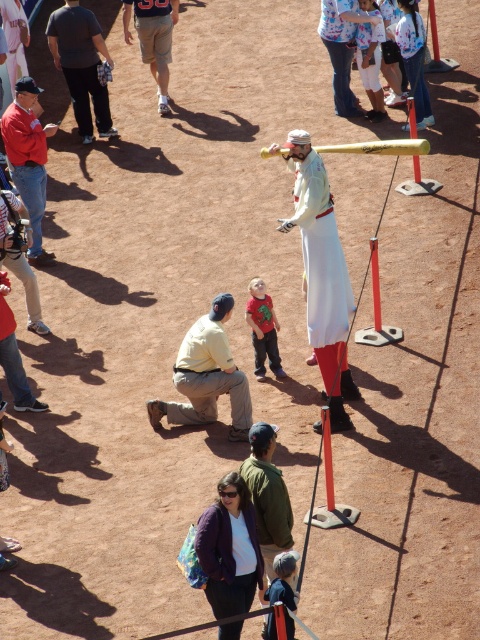
You are a visitor at the baseball field and see the dark gray fabric squat at lower center and the yellow matte baseball bat at center. Which object is wider?

The yellow matte baseball bat at center is wider than the dark gray fabric squat at lower center.

Based on the photo, you are a visitor at the baseball field and want to take a photo of the white fabric statue at center and the yellow matte baseball bat at center. Which object should you focus on first if you want to include both in the frame without moving the camera?

The white fabric statue at center is taller than the yellow matte baseball bat at center, so you should focus on the white fabric statue at center first to ensure it fits within the frame.